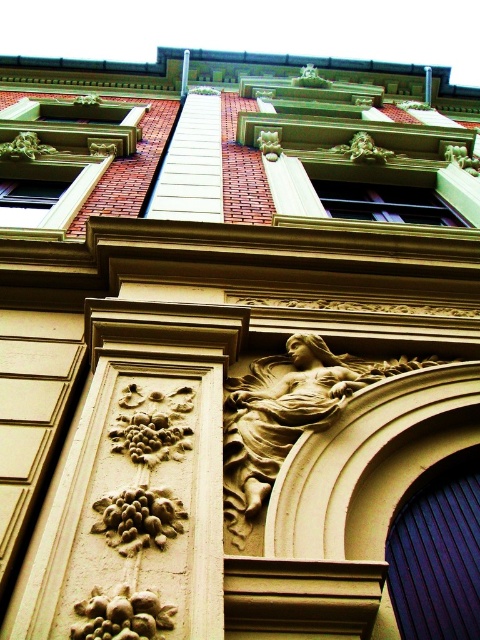
Question: From the image, what is the correct spatial relationship of carved stone column at center in relation to golden stone relief at center?

Choices:
 (A) left
 (B) right

Answer: (A)

Question: Does carved stone column at center have a larger size compared to golden stone relief at center?

Choices:
 (A) yes
 (B) no

Answer: (A)

Question: Which point appears farthest from the camera in this image?

Choices:
 (A) (164, 580)
 (B) (309, 428)

Answer: (B)

Question: Can you confirm if carved stone column at center is bigger than golden stone relief at center?

Choices:
 (A) yes
 (B) no

Answer: (A)